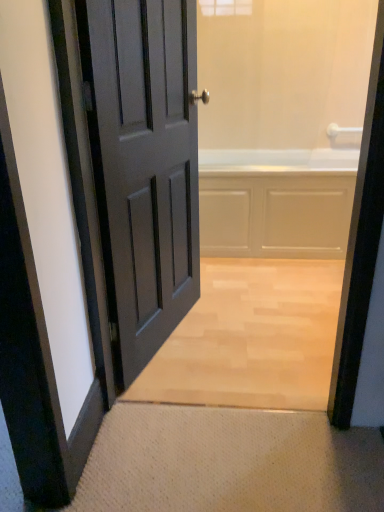
Find the location of a particular element. Image resolution: width=384 pixels, height=512 pixels. white glossy bathtub at center is located at coordinates (276, 202).

Relative to matte gray door at left, is white textured mat at lower center in front or behind?

white textured mat at lower center is behind matte gray door at left.

Based on their positions, is white textured mat at lower center located to the left or right of matte gray door at left?

white textured mat at lower center is to the right of matte gray door at left.

Is point (152, 503) behind point (96, 97)?

No.

Locate an element on the screen. doormat behind the matte gray door at left is located at coordinates (229, 462).

Locate an element on the screen. Image resolution: width=384 pixels, height=512 pixels. door that appears above the white textured mat at lower center (from a real-world perspective) is located at coordinates coord(143,166).

Which object is closer to the camera taking this photo, matte gray door at left or white textured mat at lower center?

matte gray door at left is in front.

Is matte gray door at left not close to white textured mat at lower center?

No, matte gray door at left is not far away from white textured mat at lower center.

At what (x,y) coordinates should I click in order to perform the action: click on door above the white glossy bathtub at center (from a real-world perspective). Please return your answer as a coordinate pair (x, y). Looking at the image, I should click on (143, 166).

Is white glossy bathtub at center spatially inside matte gray door at left, or outside of it?

white glossy bathtub at center is not enclosed by matte gray door at left.

From a real-world perspective, is white glossy bathtub at center located higher than matte gray door at left?

Incorrect, from a real-world perspective, white glossy bathtub at center is lower than matte gray door at left.

Between matte gray door at left and white glossy bathtub at center, which one has more height?

matte gray door at left is taller.

Is matte gray door at left not close to white glossy bathtub at center?

No.

Where is `bath behind the matte gray door at left`? Image resolution: width=384 pixels, height=512 pixels. bath behind the matte gray door at left is located at coordinates (276, 202).

Considering the relative sizes of white textured mat at lower center and white glossy bathtub at center in the image provided, is white textured mat at lower center shorter than white glossy bathtub at center?

Yes, white textured mat at lower center is shorter than white glossy bathtub at center.

You are a GUI agent. You are given a task and a screenshot of the screen. Output one action in this format:
    pyautogui.click(x=<x>, y=<y>)
    Task: Click on the bath on the right of white textured mat at lower center
    
    Given the screenshot: What is the action you would take?
    pyautogui.click(x=276, y=202)

Between white textured mat at lower center and white glossy bathtub at center, which one has larger size?

With larger size is white glossy bathtub at center.

Are white textured mat at lower center and white glossy bathtub at center located far from each other?

That's right, there is a large distance between white textured mat at lower center and white glossy bathtub at center.

Locate an element on the screen. bath above the white textured mat at lower center (from the image's perspective) is located at coordinates (276, 202).

From the image's perspective, is white glossy bathtub at center above white textured mat at lower center?

Yes, from the image's perspective, white glossy bathtub at center is over white textured mat at lower center.

Who is taller, white glossy bathtub at center or white textured mat at lower center?

white glossy bathtub at center is taller.

This screenshot has width=384, height=512. What are the coordinates of `door located above the white textured mat at lower center (from a real-world perspective)` in the screenshot? It's located at (143, 166).

Find the location of a particular element. doormat below the matte gray door at left (from the image's perspective) is located at coordinates (229, 462).

When comparing their distances from white textured mat at lower center, does white glossy bathtub at center or matte gray door at left seem closer?

Based on the image, matte gray door at left appears to be nearer to white textured mat at lower center.

Looking at this image, considering their positions, is white glossy bathtub at center positioned further to matte gray door at left than white textured mat at lower center?

Among the two, white glossy bathtub at center is located further to matte gray door at left.

From the image, which object appears to be nearer to white glossy bathtub at center, matte gray door at left or white textured mat at lower center?

matte gray door at left lies closer to white glossy bathtub at center than the other object.

Looking at this image, estimate the real-world distances between objects in this image. Which object is closer to white textured mat at lower center, matte gray door at left or white glossy bathtub at center?

Among the two, matte gray door at left is located nearer to white textured mat at lower center.

From the image, which object appears to be nearer to matte gray door at left, white textured mat at lower center or white glossy bathtub at center?

Among the two, white textured mat at lower center is located nearer to matte gray door at left.

From the image, which object appears to be farther from white glossy bathtub at center, white textured mat at lower center or matte gray door at left?

Based on the image, white textured mat at lower center appears to be further to white glossy bathtub at center.

In order to click on doormat located between matte gray door at left and white glossy bathtub at center in the depth direction in this screenshot , I will do `click(229, 462)`.